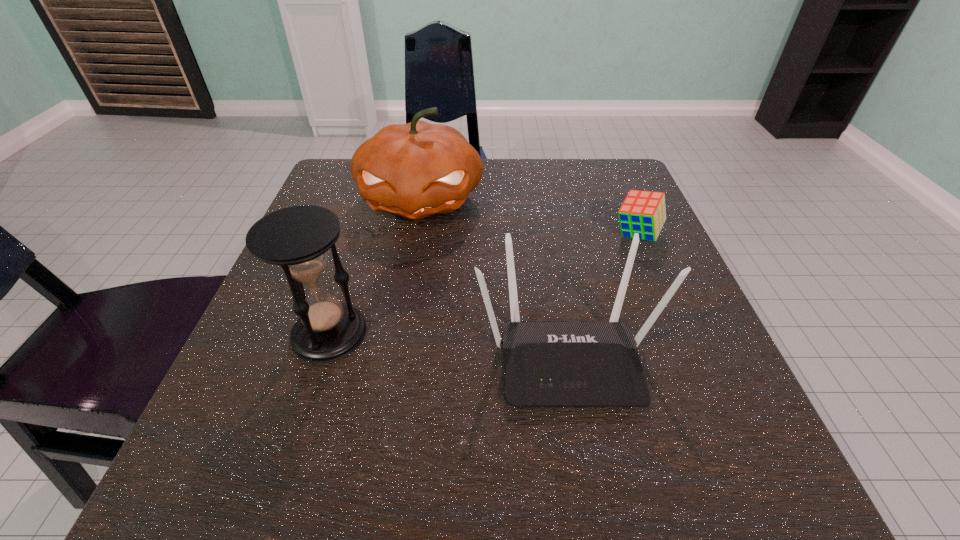
The width and height of the screenshot is (960, 540). I want to click on vacant point located between the hourglass and the router, so [448, 344].

Locate an element on the screen. The image size is (960, 540). free space between the router and the hourglass is located at coordinates (448, 344).

Locate an element on the screen. free space between the pumpkin and the hourglass is located at coordinates (374, 267).

Locate an element on the screen. The width and height of the screenshot is (960, 540). free area in between the pumpkin and the hourglass is located at coordinates (374, 267).

The image size is (960, 540). What are the coordinates of `vacant point located between the router and the hourglass` in the screenshot? It's located at (448, 344).

You are a GUI agent. You are given a task and a screenshot of the screen. Output one action in this format:
    pyautogui.click(x=<x>, y=<y>)
    Task: Click on the empty location between the cube and the second shortest object
    The width and height of the screenshot is (960, 540).
    Given the screenshot: What is the action you would take?
    pyautogui.click(x=602, y=295)

At what (x,y) coordinates should I click in order to perform the action: click on free space between the second shortest object and the pumpkin. Please return your answer as a coordinate pair (x, y). This screenshot has width=960, height=540. Looking at the image, I should click on (494, 278).

Where is `vacant space that's between the cube and the router`? Image resolution: width=960 pixels, height=540 pixels. vacant space that's between the cube and the router is located at coordinates (602, 295).

The width and height of the screenshot is (960, 540). I want to click on free space between the shortest object and the pumpkin, so click(x=529, y=218).

Select which object is the second closest to the pumpkin. Please provide its 2D coordinates. Your answer should be formatted as a tuple, i.e. [(x, y)], where the tuple contains the x and y coordinates of a point satisfying the conditions above.

[(546, 364)]